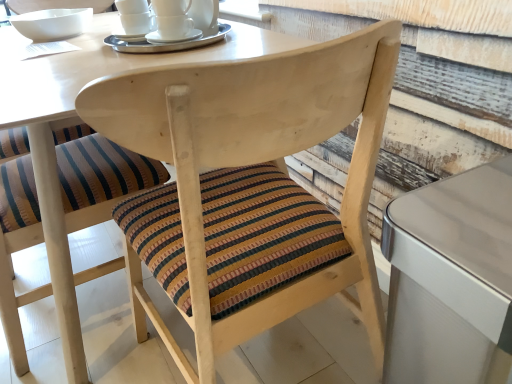
Question: From a real-world perspective, is striped fabric cushion at center, the second chair in the right-to-left sequence, physically above white ceramic cups at upper center?

Choices:
 (A) yes
 (B) no

Answer: (B)

Question: Does striped fabric cushion at center, the second chair in the right-to-left sequence, lie behind white ceramic cups at upper center?

Choices:
 (A) yes
 (B) no

Answer: (B)

Question: Can you confirm if striped fabric cushion at center, the second chair in the right-to-left sequence, is smaller than white ceramic cups at upper center?

Choices:
 (A) yes
 (B) no

Answer: (B)

Question: From a real-world perspective, is striped fabric cushion at center, the first chair positioned from the left, located beneath white ceramic cups at upper center?

Choices:
 (A) yes
 (B) no

Answer: (A)

Question: From the image's perspective, would you say striped fabric cushion at center, the second chair in the right-to-left sequence, is positioned over white ceramic cups at upper center?

Choices:
 (A) yes
 (B) no

Answer: (B)

Question: Is striped fabric cushion at center, the second chair in the right-to-left sequence, taller or shorter than metallic silver table at right?

Choices:
 (A) tall
 (B) short

Answer: (A)

Question: In terms of width, does striped fabric cushion at center, the first chair positioned from the left, look wider or thinner when compared to metallic silver table at right?

Choices:
 (A) thin
 (B) wide

Answer: (B)

Question: From the image's perspective, is striped fabric cushion at center, the second chair in the right-to-left sequence, positioned above or below metallic silver table at right?

Choices:
 (A) below
 (B) above

Answer: (B)

Question: Is point (168, 177) closer or farther from the camera than point (494, 188)?

Choices:
 (A) farther
 (B) closer

Answer: (A)

Question: Is white ceramic cups at upper center to the left or to the right of metallic silver table at right in the image?

Choices:
 (A) left
 (B) right

Answer: (A)

Question: From the image's perspective, is white ceramic cups at upper center located above or below metallic silver table at right?

Choices:
 (A) above
 (B) below

Answer: (A)

Question: From a real-world perspective, relative to metallic silver table at right, is white ceramic cups at upper center vertically above or below?

Choices:
 (A) below
 (B) above

Answer: (B)

Question: In the image, is white ceramic cups at upper center positioned in front of or behind metallic silver table at right?

Choices:
 (A) front
 (B) behind

Answer: (B)

Question: From their relative heights in the image, would you say striped fabric cushion at center, the first chair positioned from the left, is taller or shorter than wooden chair at center, arranged as the first chair when viewed from the right?

Choices:
 (A) short
 (B) tall

Answer: (A)

Question: Is striped fabric cushion at center, the second chair in the right-to-left sequence, wider or thinner than wooden chair at center, which is the second chair from left to right?

Choices:
 (A) wide
 (B) thin

Answer: (B)